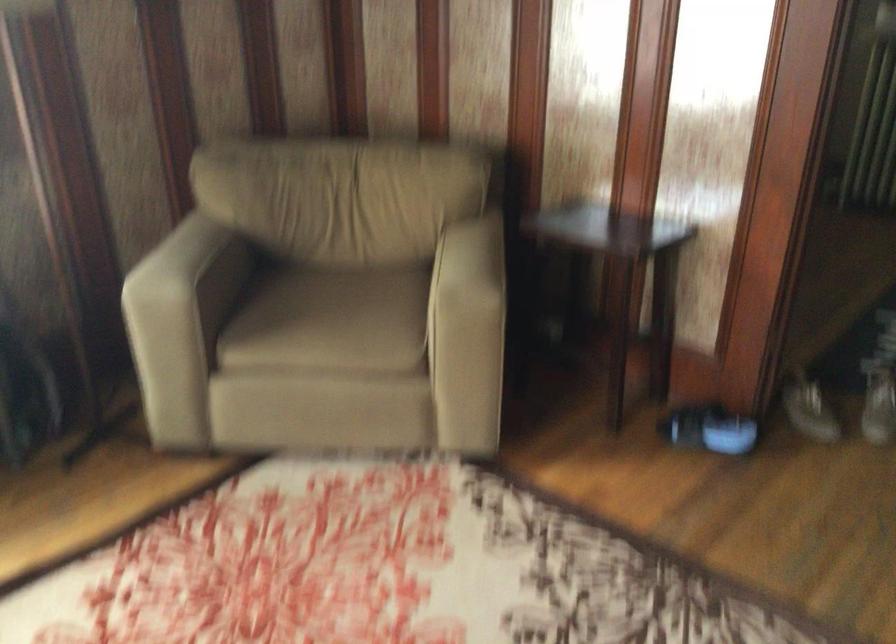
Where is `chair armrest`? The width and height of the screenshot is (896, 644). chair armrest is located at coordinates (194, 245).